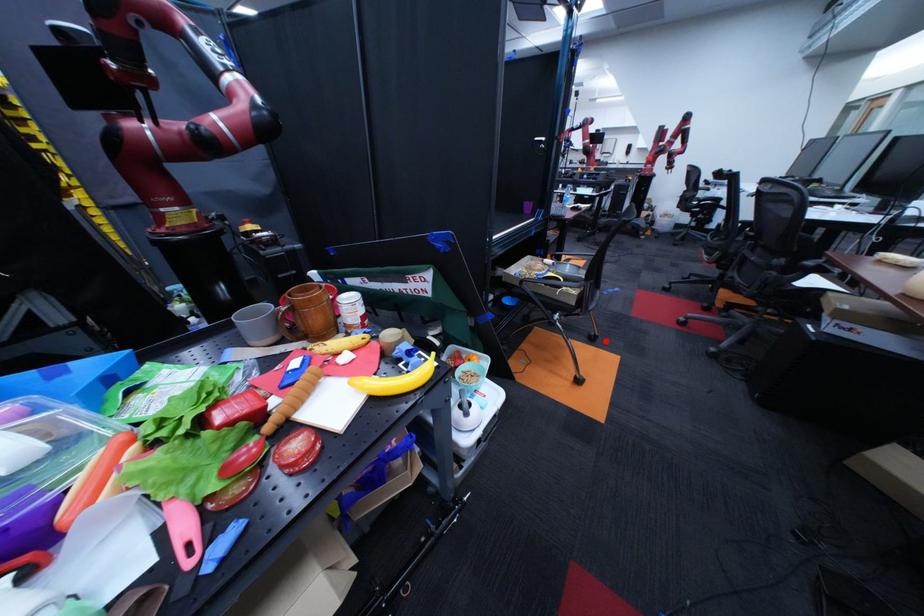
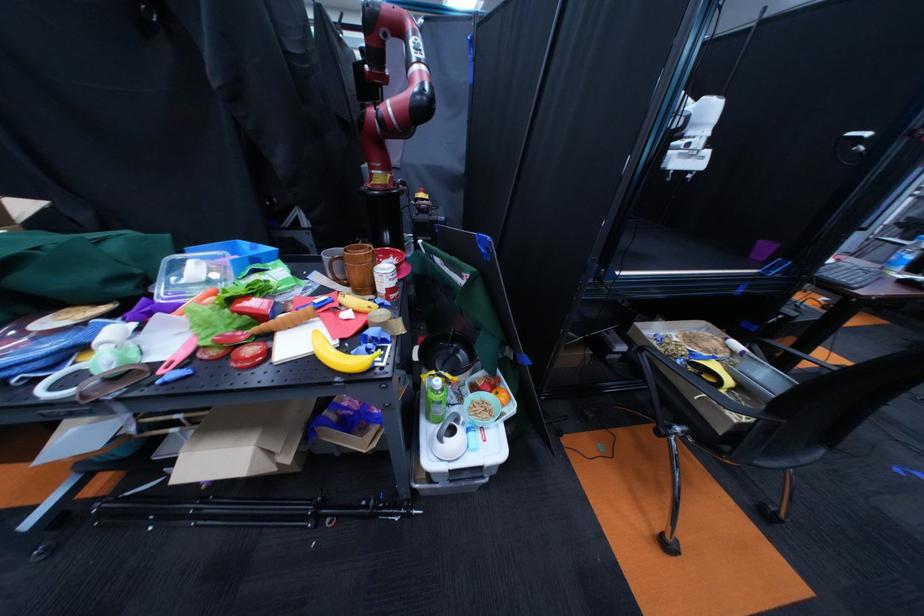
Find the pixel in the second image that matches the highlighted location in the first image.

(776, 517)